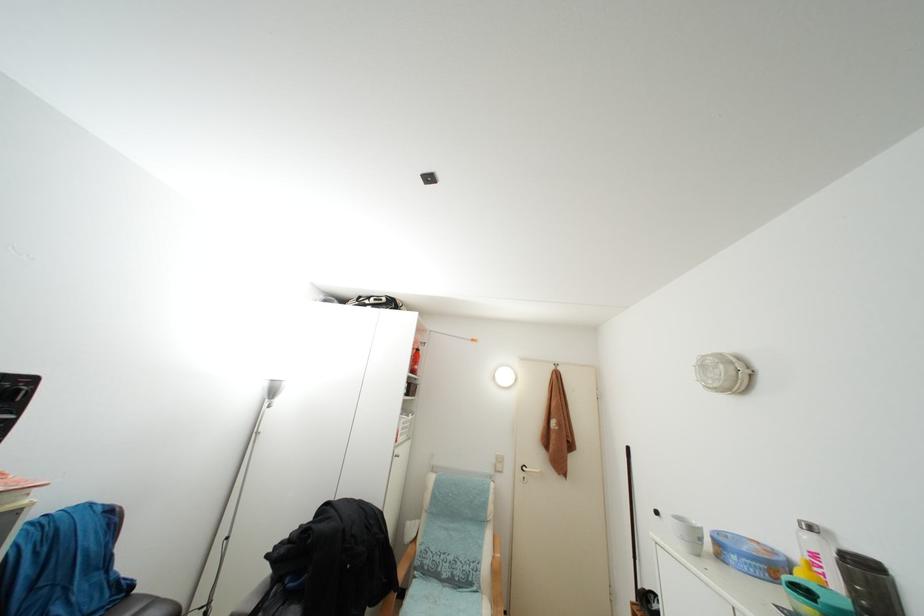
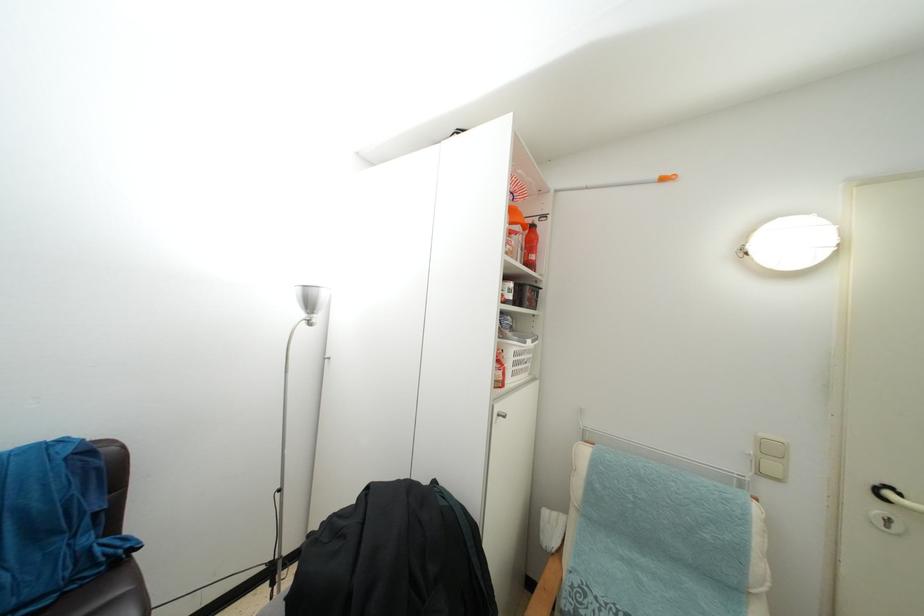
Where in the second image is the point corresponding to (421,355) from the first image?

(537, 233)